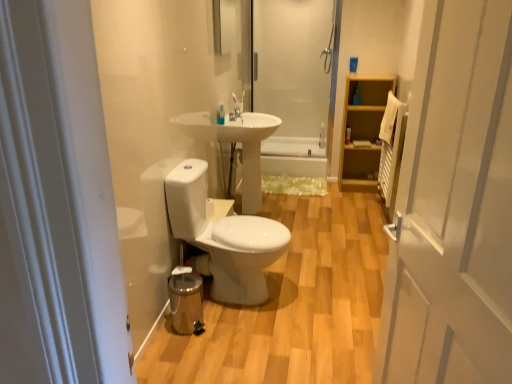
Question: Would you say transparent glass shower door at upper center is outside white glossy toilet at center?

Choices:
 (A) no
 (B) yes

Answer: (B)

Question: Does transparent glass shower door at upper center come in front of white glossy toilet at center?

Choices:
 (A) yes
 (B) no

Answer: (B)

Question: Is the depth of transparent glass shower door at upper center greater than that of white glossy toilet at center?

Choices:
 (A) yes
 (B) no

Answer: (A)

Question: Considering the relative sizes of transparent glass shower door at upper center and white glossy toilet at center in the image provided, is transparent glass shower door at upper center thinner than white glossy toilet at center?

Choices:
 (A) no
 (B) yes

Answer: (B)

Question: Is transparent glass shower door at upper center wider than white glossy toilet at center?

Choices:
 (A) no
 (B) yes

Answer: (A)

Question: From a real-world perspective, is transparent glass shower door at upper center physically below white glossy toilet at center?

Choices:
 (A) yes
 (B) no

Answer: (B)

Question: From the image's perspective, is glossy glass mirror at upper center located above white glossy toothbrush at upper center, placed as the 2th toiletry when sorted from right to left?

Choices:
 (A) no
 (B) yes

Answer: (B)

Question: Is glossy glass mirror at upper center outside white glossy toothbrush at upper center, acting as the first toiletry starting from the left?

Choices:
 (A) yes
 (B) no

Answer: (A)

Question: Is glossy glass mirror at upper center wider than white glossy toothbrush at upper center, placed as the 2th toiletry when sorted from right to left?

Choices:
 (A) yes
 (B) no

Answer: (A)

Question: From the image's perspective, is glossy glass mirror at upper center beneath white glossy toothbrush at upper center, which is counted as the second toiletry, starting from the back?

Choices:
 (A) yes
 (B) no

Answer: (B)

Question: Does glossy glass mirror at upper center come behind white glossy toothbrush at upper center, acting as the first toiletry starting from the left?

Choices:
 (A) no
 (B) yes

Answer: (A)

Question: Is glossy glass mirror at upper center oriented away from white glossy toothbrush at upper center, the first toiletry positioned from the front?

Choices:
 (A) yes
 (B) no

Answer: (B)

Question: Is translucent plastic bottle at upper right, the 1th toiletry in the back-to-front sequence, far away from transparent glass shower door at upper center?

Choices:
 (A) yes
 (B) no

Answer: (B)